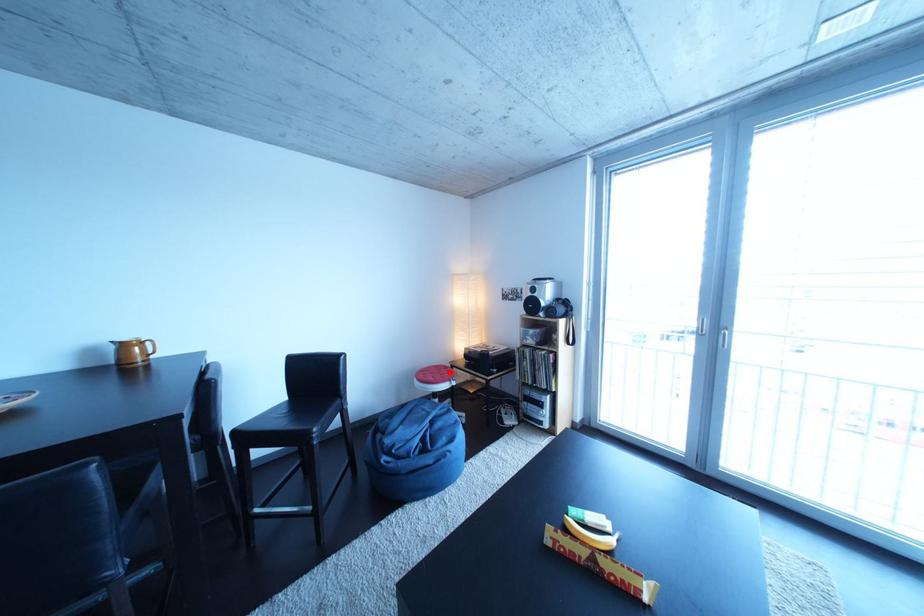
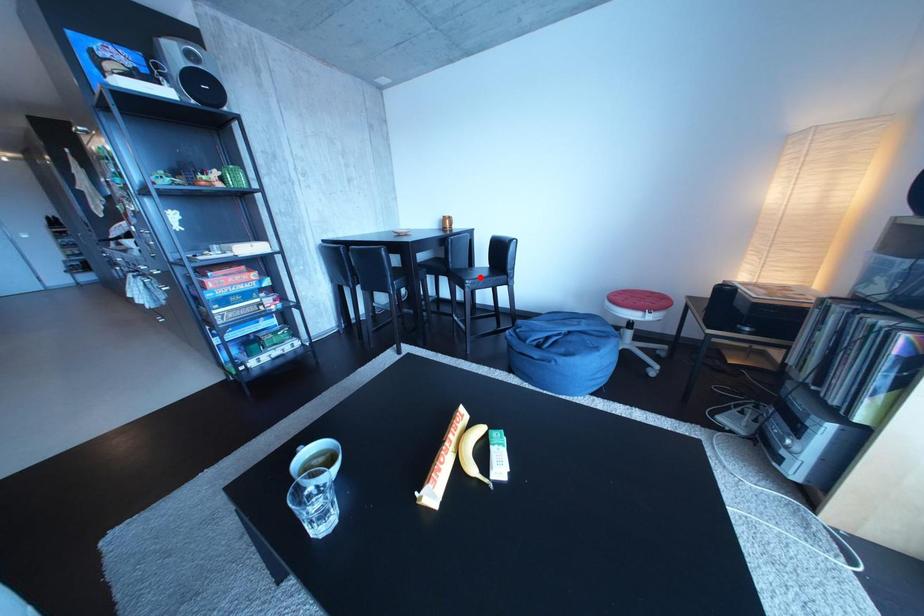
I am providing you with two images of the same scene from different viewpoints. A red point is marked on the first image and another point is marked on the second image. Is the marked point in image1 the same physical position as the marked point in image2?

No